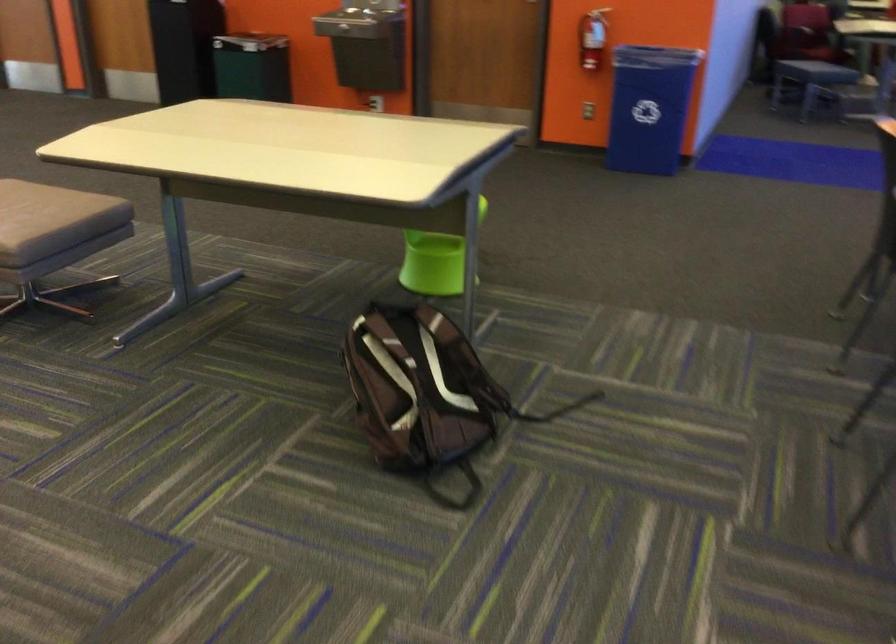
Find the location of a particular element. gray sitting surface is located at coordinates (39, 203).